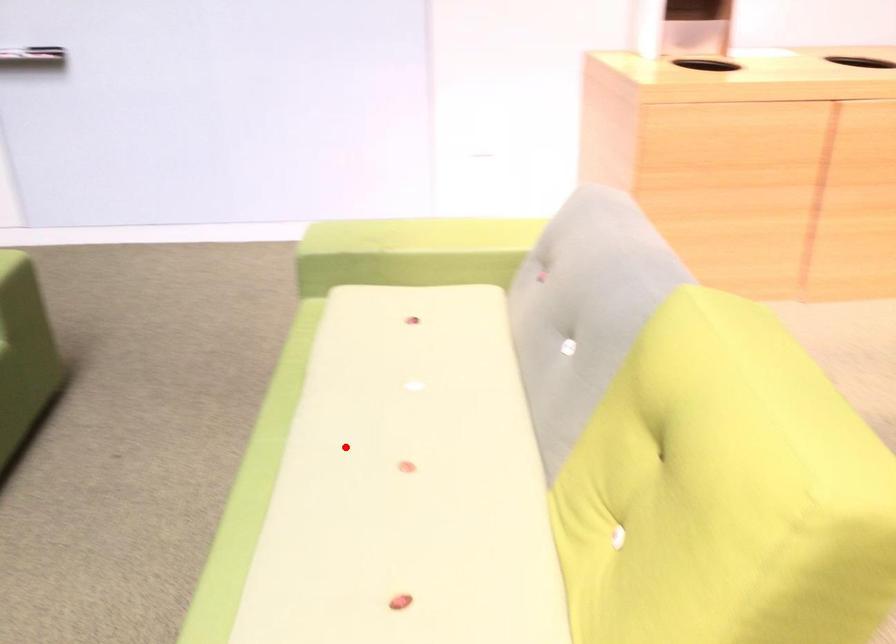
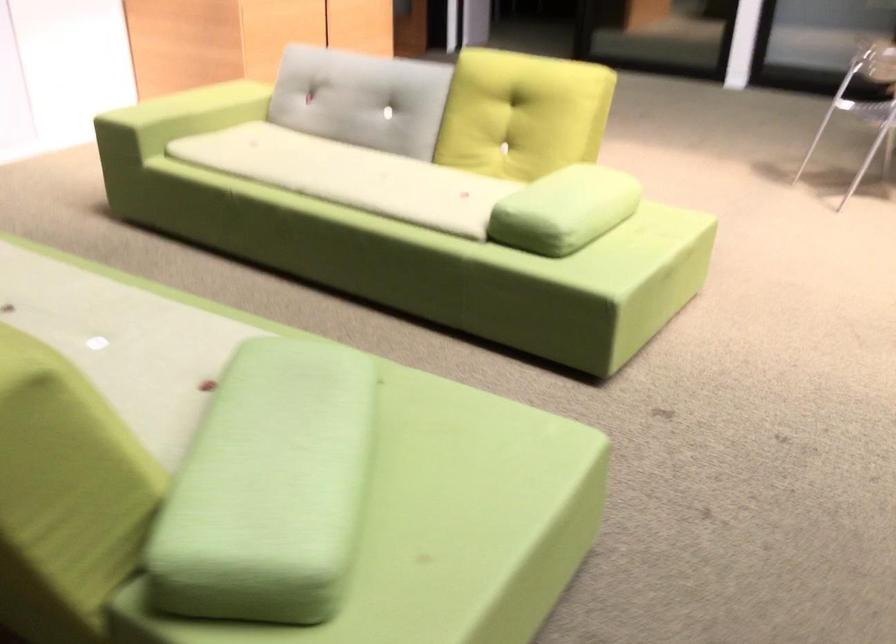
In the second image, find the point that corresponds to the highlighted location in the first image.

(349, 176)